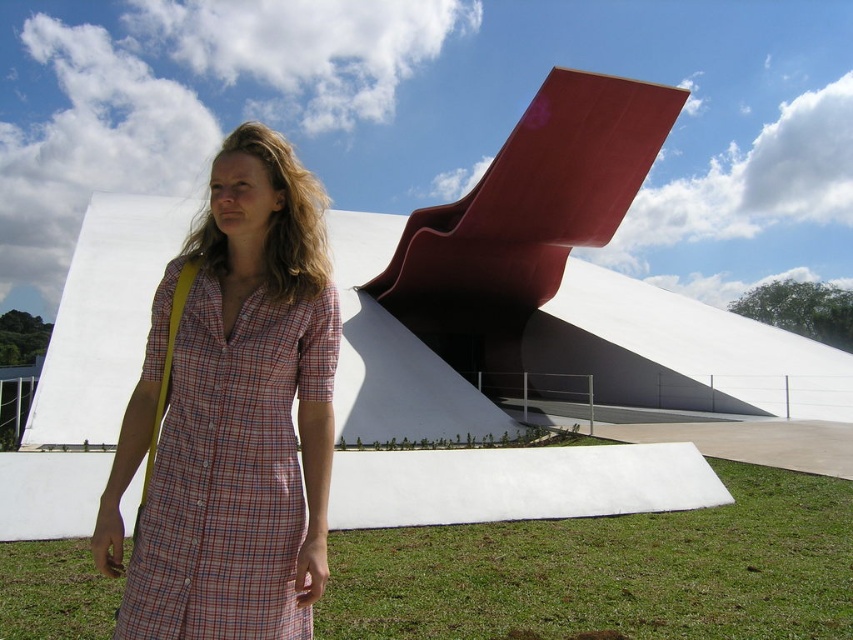
How distant is green grass at lower center from plaid cotton dress at center?

green grass at lower center is 15.28 feet from plaid cotton dress at center.

The width and height of the screenshot is (853, 640). In order to click on green grass at lower center in this screenshot , I will do `click(610, 572)`.